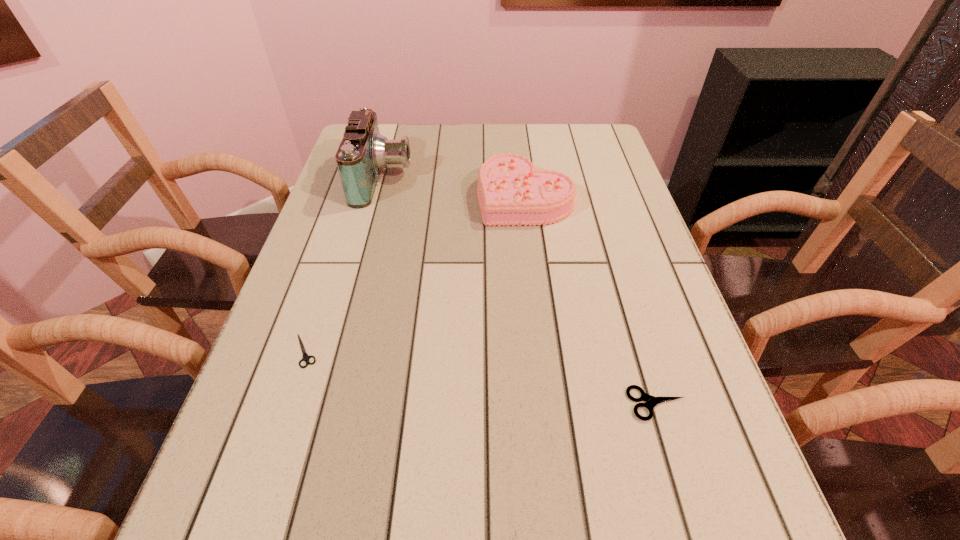
Where is `camcorder`? The height and width of the screenshot is (540, 960). camcorder is located at coordinates (363, 152).

I want to click on the second object from right to left, so click(x=511, y=191).

Where is `the second tallest object`? The image size is (960, 540). the second tallest object is located at coordinates click(511, 191).

Locate an element on the screen. the nearer shears is located at coordinates coord(651,401).

This screenshot has width=960, height=540. I want to click on the second shortest object, so click(651, 401).

Locate an element on the screen. This screenshot has width=960, height=540. the second nearest object is located at coordinates (306, 357).

Find the location of `the shorter shears`. the shorter shears is located at coordinates (x=306, y=357).

Find the location of `blank area located 0.340m on the front-facing side of the camcorder`. blank area located 0.340m on the front-facing side of the camcorder is located at coordinates (535, 179).

You are a GUI agent. You are given a task and a screenshot of the screen. Output one action in this format:
    pyautogui.click(x=<x>, y=<y>)
    Task: Click on the vacant space located 0.200m on the left of the third object from left to right
    This screenshot has width=960, height=540.
    Given the screenshot: What is the action you would take?
    coord(401,197)

This screenshot has height=540, width=960. Find the location of `vacant area located on the front of the nearer shears`. vacant area located on the front of the nearer shears is located at coordinates (672, 453).